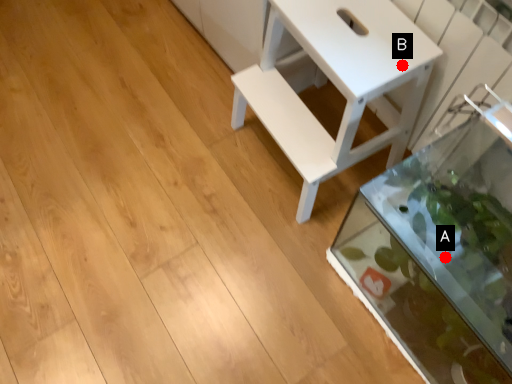
Question: Two points are circled on the image, labeled by A and B beside each circle. Which point is closer to the camera?

Choices:
 (A) A is closer
 (B) B is closer

Answer: (A)